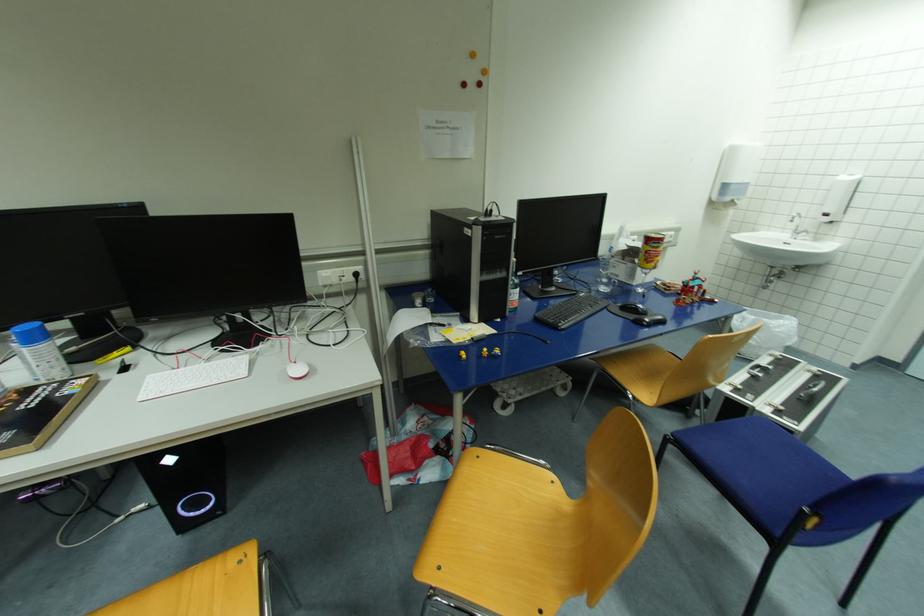
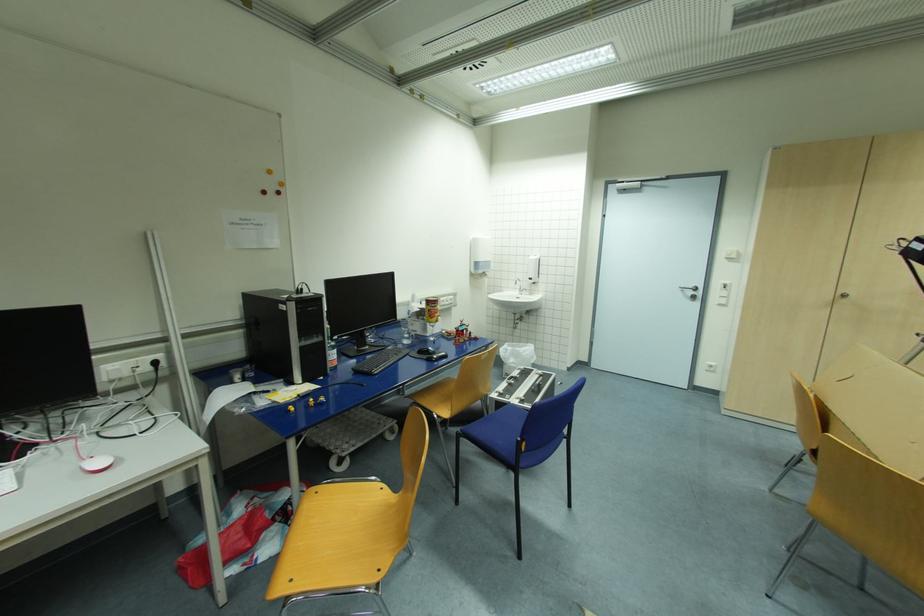
Find the pixel in the second image that matches point (517, 296) in the first image.

(335, 355)